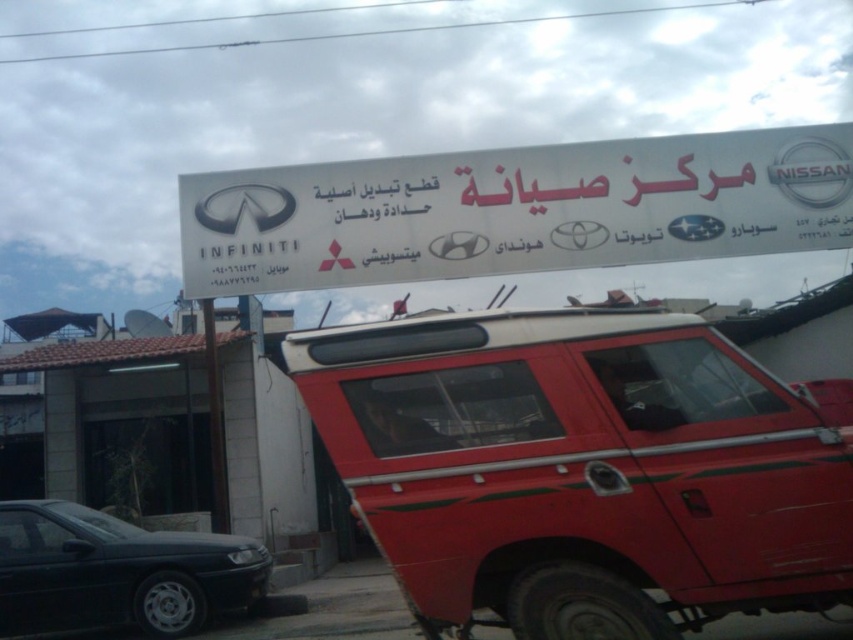
Question: Which object appears closest to the camera in this image?

Choices:
 (A) white plastic sign at center
 (B) shiny red jeep at center

Answer: (B)

Question: Is the position of shiny red jeep at center less distant than that of white plastic sign at center?

Choices:
 (A) yes
 (B) no

Answer: (A)

Question: Which object is the closest to the matte black sedan at lower left?

Choices:
 (A) shiny red jeep at center
 (B) white plastic sign at center

Answer: (B)

Question: Does white plastic sign at center have a smaller size compared to matte black sedan at lower left?

Choices:
 (A) yes
 (B) no

Answer: (B)

Question: Is shiny red jeep at center smaller than white plastic sign at center?

Choices:
 (A) yes
 (B) no

Answer: (A)

Question: Which object appears farthest from the camera in this image?

Choices:
 (A) shiny red jeep at center
 (B) white plastic sign at center

Answer: (B)